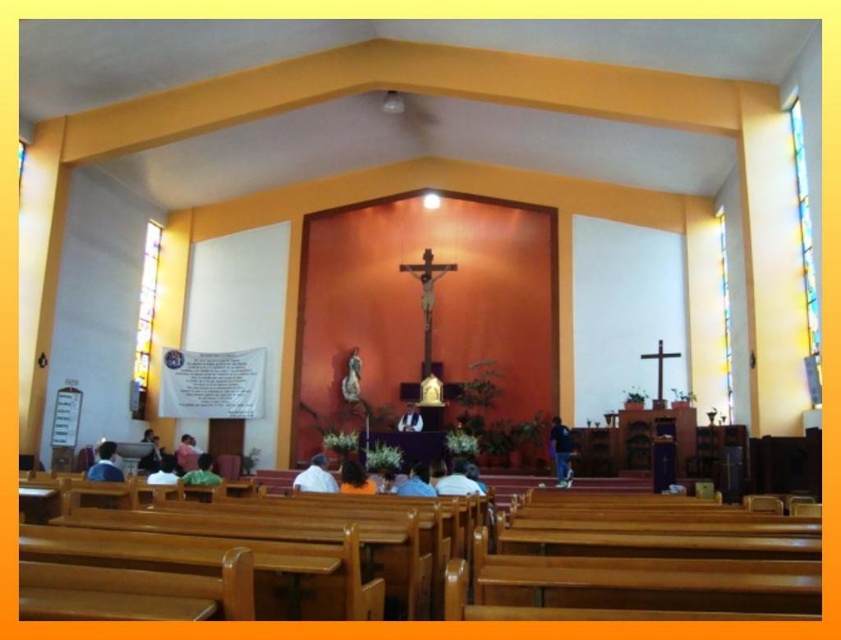
In the scene shown: You are standing in the church and want to take a photo of the altar area. Your camera has a focal length of 24mm and you are currently at a distance of 17.23 meters from the point marked at coordinates point (308, 465). To ensure the altar is in focus, should you adjust your camera settings to a smaller or larger aperture?

The point marked at coordinates point (308, 465) is 17.23 meters away from the camera. To ensure the altar area is in focus, you should adjust the camera to a smaller aperture, which increases depth of field, allowing for clearer focus at that distance.

Based on the photo, you are standing at the entrance of the church and see the dark blue fabric at center. Can you determine its exact location in the room based on the coordinates provided?

The dark blue fabric at center is located at point (x=559, y=451), which means it is positioned towards the right and slightly forward from the center of the room.

You are a photographer standing in the church and want to capture both the white matte shirt at center and the white fabric shirt at center in the same frame. Which shirt should you adjust to the right to ensure both are visible?

The white matte shirt at center is positioned on the left side of white fabric shirt at center, so you should move the white matte shirt at center to the right to make space for both shirts in the frame.